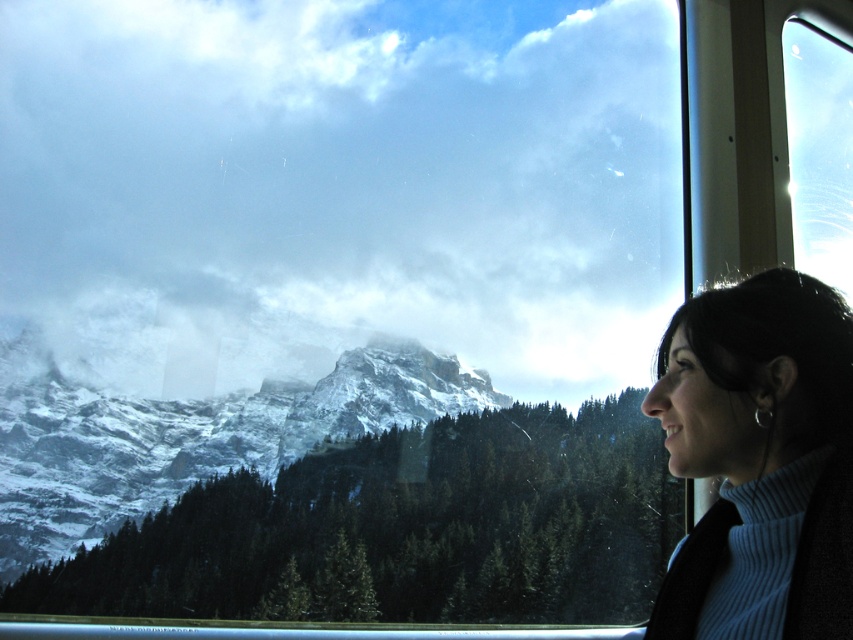
You are a passenger sitting in the train or cable car and want to take a photo of the snowy rock mountain at center and the light blue turtleneck sweater at right. Which object will occupy more space in your photo?

The snowy rock mountain at center will occupy more space in the photo because its width is larger than the light blue turtleneck sweater at right.

Consider the image. You are a passenger on the train and want to see the mountain view outside. Is the light blue turtleneck sweater at right blocking your view through the transparent glass window at upper right?

The light blue turtleneck sweater at right is to the left of the transparent glass window at upper right, so it is positioned in a way that might block the view depending on your seating position. If the sweater is placed to the left side of the window, it could obstruct part of the window area.

You are a traveler sitting inside the vehicle and want to check the weather outside. Which object, the light blue turtleneck sweater at right or the transparent glass window at upper right, would you use to see the mountain view?

You would use the transparent glass window at upper right to see the mountain view because it is transparent, while the light blue turtleneck sweater at right is an item of clothing and not see through.